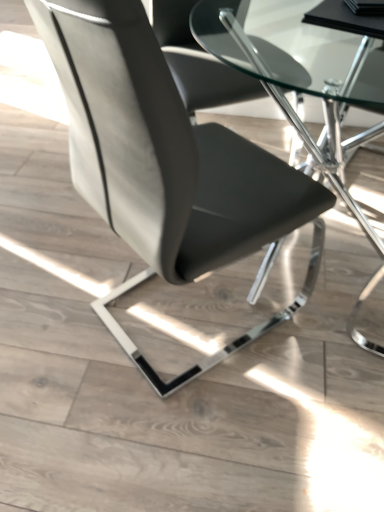
Question: Is matte black chair at center bigger than transparent glass table at center?

Choices:
 (A) yes
 (B) no

Answer: (B)

Question: From the image's perspective, is matte black chair at center on transparent glass table at center?

Choices:
 (A) no
 (B) yes

Answer: (A)

Question: Does matte black chair at center have a greater height compared to transparent glass table at center?

Choices:
 (A) no
 (B) yes

Answer: (B)

Question: Considering the relative sizes of matte black chair at center and transparent glass table at center in the image provided, is matte black chair at center wider than transparent glass table at center?

Choices:
 (A) yes
 (B) no

Answer: (B)

Question: Can you confirm if matte black chair at center is thinner than transparent glass table at center?

Choices:
 (A) no
 (B) yes

Answer: (B)

Question: Would you say matte black chair at center is a long distance from transparent glass table at center?

Choices:
 (A) no
 (B) yes

Answer: (A)

Question: From the image's perspective, is transparent glass table at center on top of matte black chair at center?

Choices:
 (A) no
 (B) yes

Answer: (B)

Question: Is transparent glass table at center aimed at matte black chair at center?

Choices:
 (A) no
 (B) yes

Answer: (B)

Question: Can you see transparent glass table at center touching matte black chair at center?

Choices:
 (A) yes
 (B) no

Answer: (B)

Question: Does transparent glass table at center have a larger size compared to matte black chair at center?

Choices:
 (A) no
 (B) yes

Answer: (B)

Question: Does transparent glass table at center have a lesser height compared to matte black chair at center?

Choices:
 (A) no
 (B) yes

Answer: (B)

Question: Considering the relative sizes of transparent glass table at center and matte black chair at center in the image provided, is transparent glass table at center wider than matte black chair at center?

Choices:
 (A) yes
 (B) no

Answer: (A)

Question: In the image, is matte black chair at center positioned in front of or behind transparent glass table at center?

Choices:
 (A) behind
 (B) front

Answer: (B)